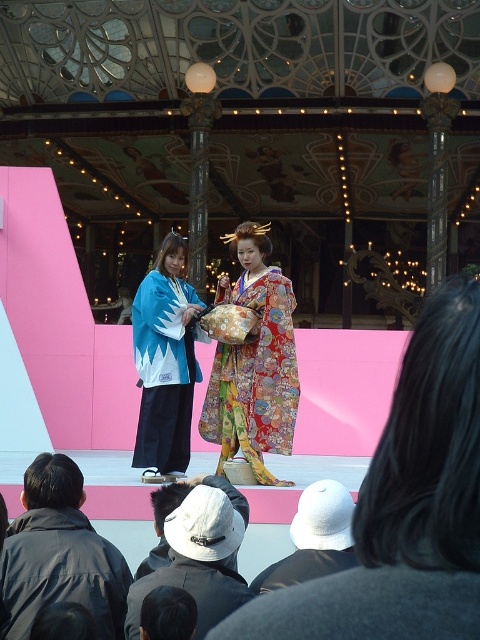
Question: Estimate the real-world distances between objects in this image. Which object is farther from the floral silk kimono at center?

Choices:
 (A) blue and white kimono at center
 (B) white cotton hat at lower center
 (C) white fabric hat at lower center
 (D) dark gray jacket at lower left

Answer: (D)

Question: In this image, where is dark gray jacket at lower left located relative to floral silk kimono at center?

Choices:
 (A) left
 (B) right

Answer: (A)

Question: Can you confirm if floral silk kimono at center is positioned below blue and white kimono at center?

Choices:
 (A) yes
 (B) no

Answer: (B)

Question: Which point is closer to the camera?

Choices:
 (A) dark gray jacket at lower left
 (B) white cotton hat at lower center
 (C) white fabric hat at lower center
 (D) floral silk kimono at center

Answer: (A)

Question: Does floral silk kimono at center lie behind white cotton hat at lower center?

Choices:
 (A) no
 (B) yes

Answer: (B)

Question: Which object appears closest to the camera in this image?

Choices:
 (A) white cotton hat at lower center
 (B) blue and white kimono at center

Answer: (A)